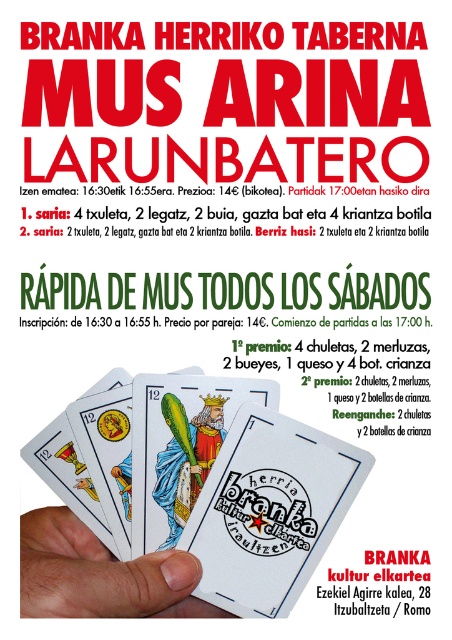
In order to click on matte plastic cards at center in this screenshot , I will do `click(227, 488)`.

This screenshot has height=640, width=452. What are the coordinates of `matte plastic cards at center` in the screenshot? It's located at (227, 488).

Is point (244, 448) positioned behind point (172, 428)?

No, (244, 448) is in front of (172, 428).

Between point (221, 529) and point (136, 460), which one is positioned in front?

Point (221, 529) is in front.

Is point (269, 611) less distant than point (136, 404)?

Yes, it is.

Where is `matte plastic playing card at center`? matte plastic playing card at center is located at coordinates (269, 509).

Which is more to the left, matte plastic cards at center or matte plastic playing card at center?

matte plastic cards at center

Is point (155, 387) positioned behind point (271, 550)?

That is True.

At what (x,y) coordinates should I click in order to perform the action: click on matte plastic cards at center. Please return your answer as a coordinate pair (x, y). The width and height of the screenshot is (452, 640). Looking at the image, I should click on (227, 488).